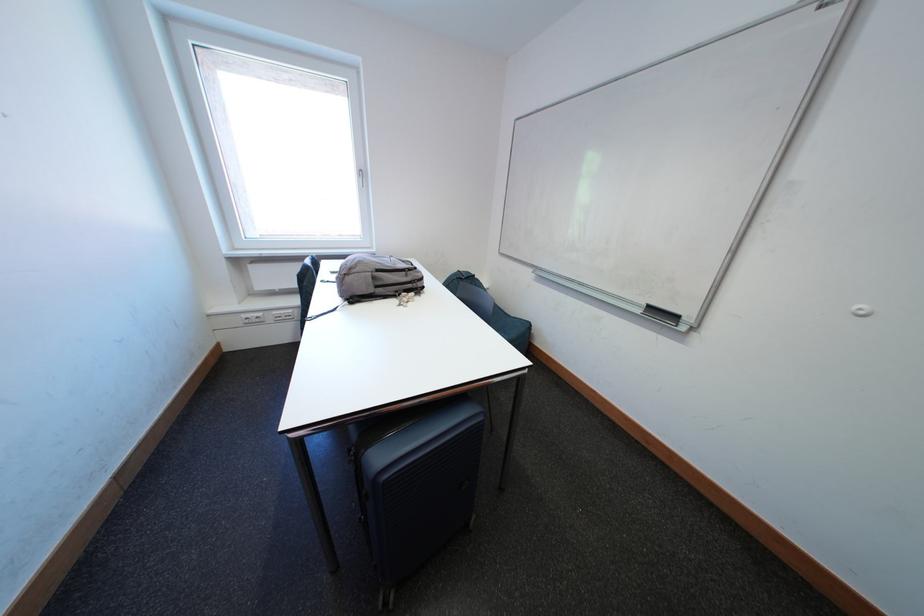
At what (x,y) coordinates should I click in order to perform the action: click on black suitcase handle. Please return your answer as a coordinate pair (x, y). Looking at the image, I should click on (378, 509).